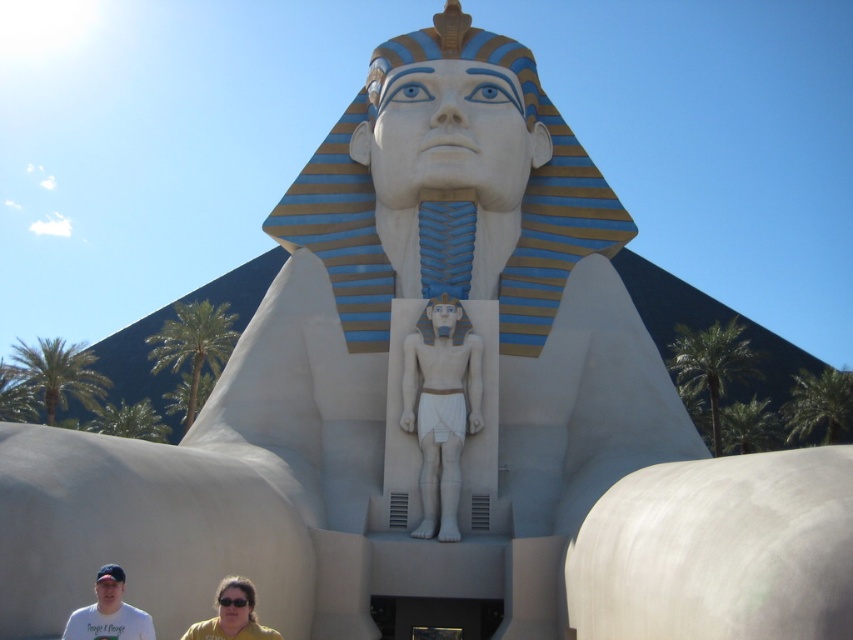
You are standing in front of the Sphinx replica and want to determine which of the two points, point (65, 634) or point (221, 637), is nearer to you. Based on the scene description, which point is closer?

Point (65, 634) is closer to the viewer than point (221, 637).